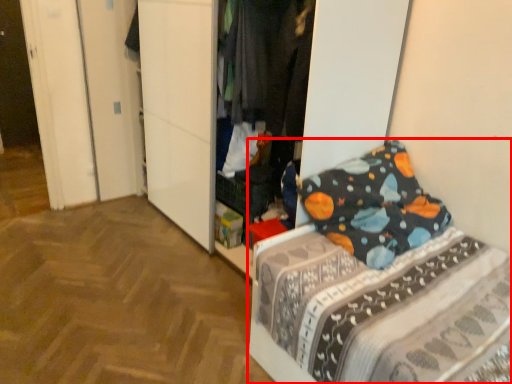
Question: In this image, where is bed (annotated by the red box) located relative to clothing?

Choices:
 (A) right
 (B) left

Answer: (A)